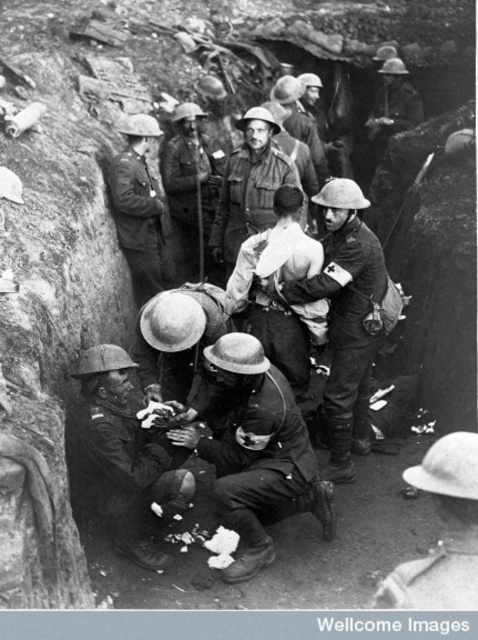
Which is more to the right, matte black helmet at lower left or matte khaki uniform at center?

Positioned to the right is matte black helmet at lower left.

Between matte black helmet at lower left and matte khaki uniform at center, which one has more height?

With more height is matte khaki uniform at center.

Where is `matte black helmet at lower left`? This screenshot has width=478, height=640. matte black helmet at lower left is located at coordinates (129, 456).

Locate an element on the screen. matte black helmet at lower left is located at coordinates (129, 456).

Is the position of light brown leather jacket at center less distant than that of smooth leather helmet at center?

Yes, light brown leather jacket at center is closer to the viewer.

Identify the location of light brown leather jacket at center. (276, 298).

You are a GUI agent. You are given a task and a screenshot of the screen. Output one action in this format:
    pyautogui.click(x=<x>, y=<y>)
    Task: Click on the light brown leather jacket at center
    
    Given the screenshot: What is the action you would take?
    pyautogui.click(x=276, y=298)

Can you confirm if matte black helmet at center is positioned below light brown leather jacket at center?

Correct, matte black helmet at center is located below light brown leather jacket at center.

Find the location of a particular element. matte black helmet at center is located at coordinates (254, 449).